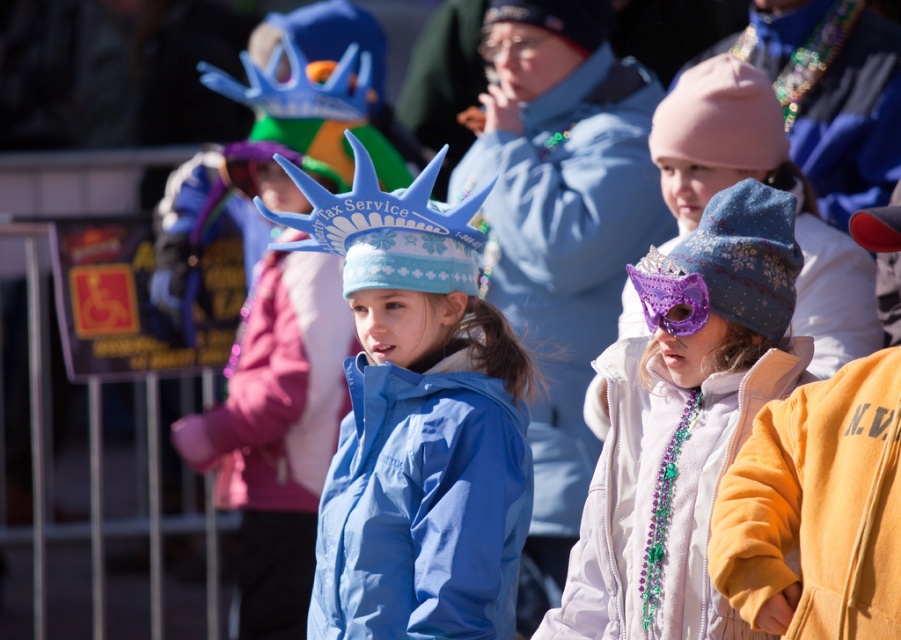
You are a photographer trying to capture the children in the foreground. Which of the two hats, the matte blue hat at center or the blue knitted hat at center, is positioned lower on the child?

The matte blue hat at center is positioned lower on the child because it is below the blue knitted hat at center.

You are a photographer trying to capture the children in the foreground. You notice the matte blue hat at center and the blue matte jacket at center. Which object is located to the right of the other?

The matte blue hat at center is positioned on the right side of blue matte jacket at center, so the matte blue hat at center is to the right of the blue matte jacket at center.

You are a photographer trying to capture a group photo of the matte blue jacket at center and the white fleece jacket at center. Since you want both jackets to be in the frame, which one should you position your camera closer to?

You should position your camera closer to the matte blue jacket at center because it is to the left of the white fleece jacket at center, so adjusting the camera position ensures both are in frame.